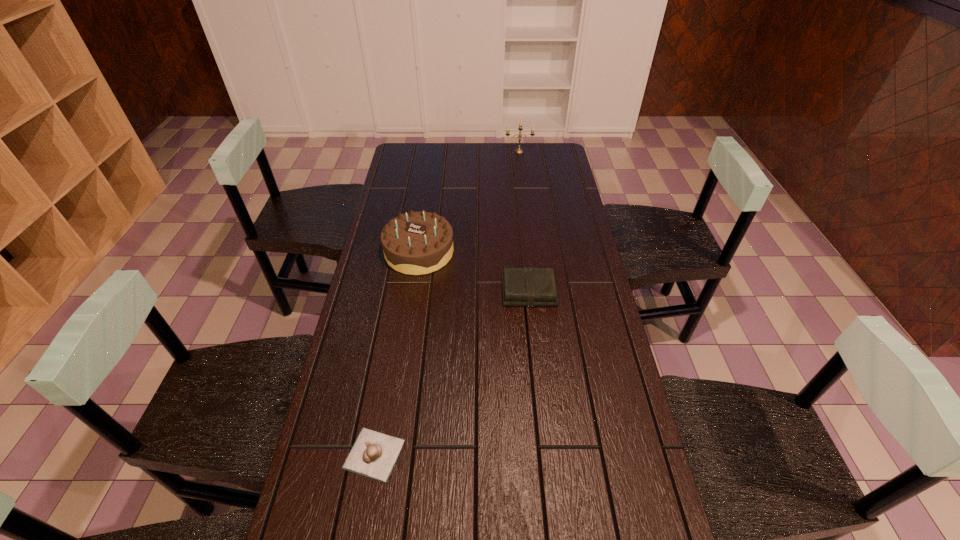
You are a GUI agent. You are given a task and a screenshot of the screen. Output one action in this format:
    pyautogui.click(x=<x>, y=<y>)
    Task: Click on the free space located 0.090m on the front of the third farthest object
    
    Given the screenshot: What is the action you would take?
    pyautogui.click(x=533, y=330)

This screenshot has width=960, height=540. Identify the location of vacant area located on the right of the garlic. (508, 454).

Identify the location of object that is at the far edge. Image resolution: width=960 pixels, height=540 pixels. (518, 150).

Where is `birthday cake situated at the left edge`? birthday cake situated at the left edge is located at coordinates (416, 243).

At what (x,y) coordinates should I click in order to perform the action: click on garlic that is positioned at the left edge. Please return your answer as a coordinate pair (x, y). The height and width of the screenshot is (540, 960). Looking at the image, I should click on (374, 454).

Identify the location of candle that is at the right edge. This screenshot has height=540, width=960. (518, 150).

Locate an element on the screen. The width and height of the screenshot is (960, 540). book that is at the right edge is located at coordinates (x=528, y=286).

Locate an element on the screen. object located in the far right corner section of the desktop is located at coordinates (518, 150).

In the image, there is a desktop. What are the coordinates of `vacant space at the far edge` in the screenshot? It's located at tap(494, 148).

Where is `vacant area at the left edge`? Image resolution: width=960 pixels, height=540 pixels. vacant area at the left edge is located at coordinates (343, 354).